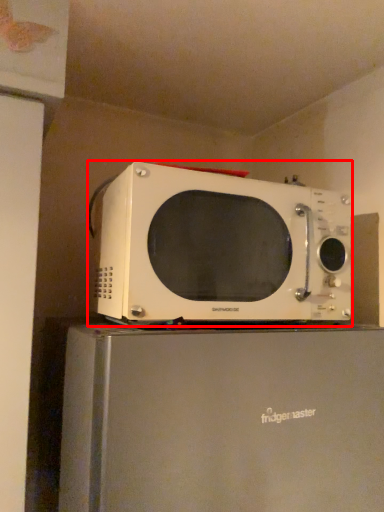
Question: From the image, what is the correct spatial relationship of microwave oven (annotated by the red box) in relation to appliance?

Choices:
 (A) right
 (B) left

Answer: (A)